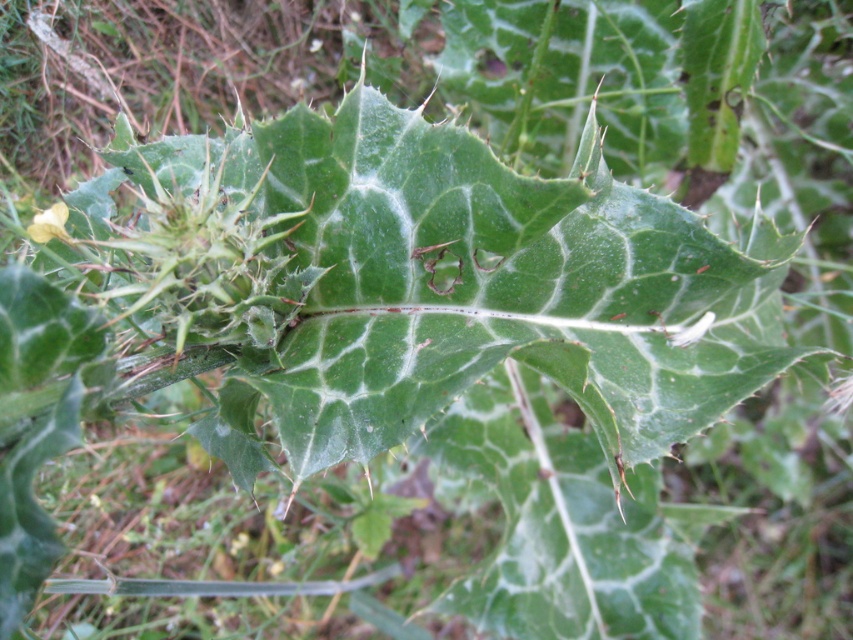
You are a botanist examining a plant specimen. You notice the green matte leaf at center and the yellow matte flower at upper left. Which object has a greater width according to the description?

The green matte leaf at center has a greater width than the yellow matte flower at upper left.

You are an artist sketching this plant. You want to draw the green matte leaf at center and the yellow matte flower at upper left. Which object should you draw first to maintain the correct spatial relationship?

You should draw the green matte leaf at center first because it is in front of the yellow matte flower at upper left, so it should be placed over the flower in your sketch.

You are a botanist examining the plant. You need to determine which object is taller between the green matte leaf at center and the yellow matte flower at upper left. Based on the scene, which one is taller?

The green matte leaf at center is much taller than the yellow matte flower at upper left.